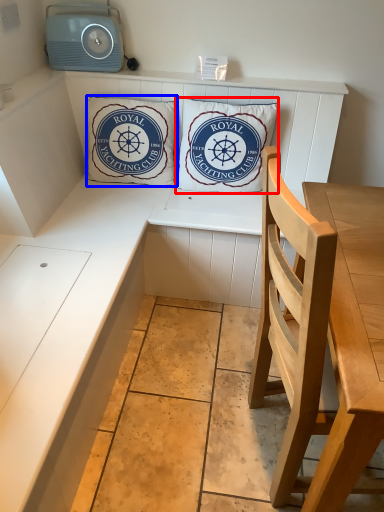
Question: Among these objects, which one is nearest to the camera, pillow (highlighted by a red box) or pillow (highlighted by a blue box)?

Choices:
 (A) pillow
 (B) pillow

Answer: (A)